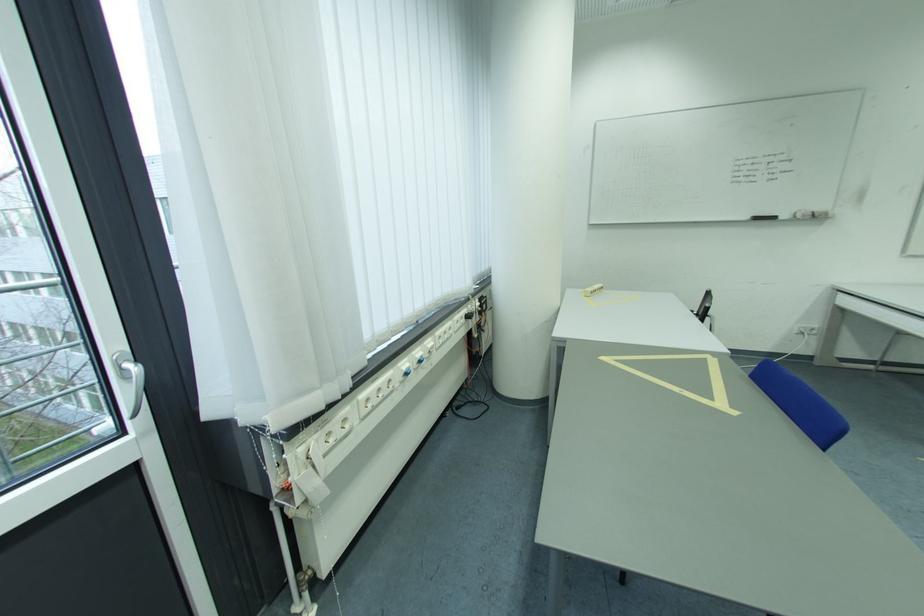
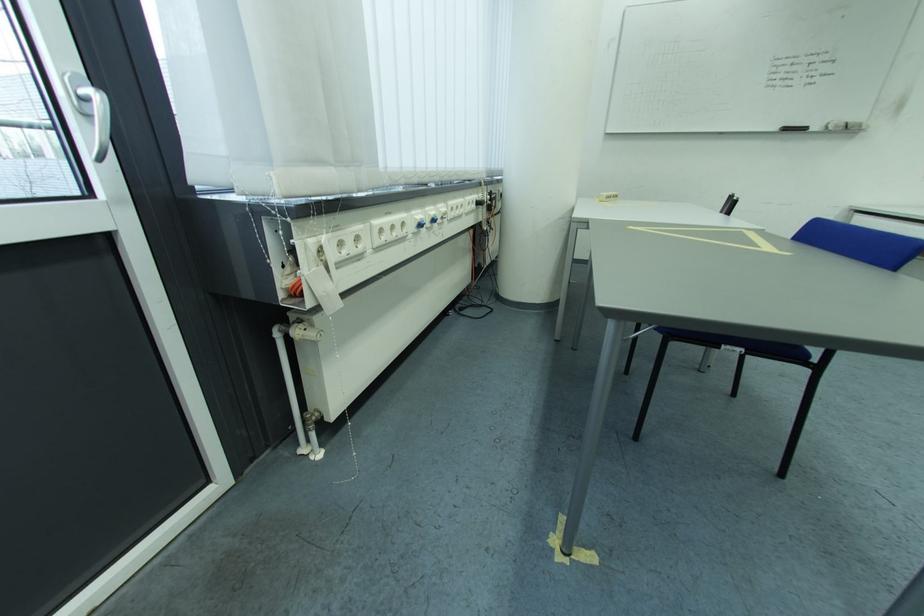
In the second image, find the point that corresponds to the point at 766,221 in the first image.

(796, 131)